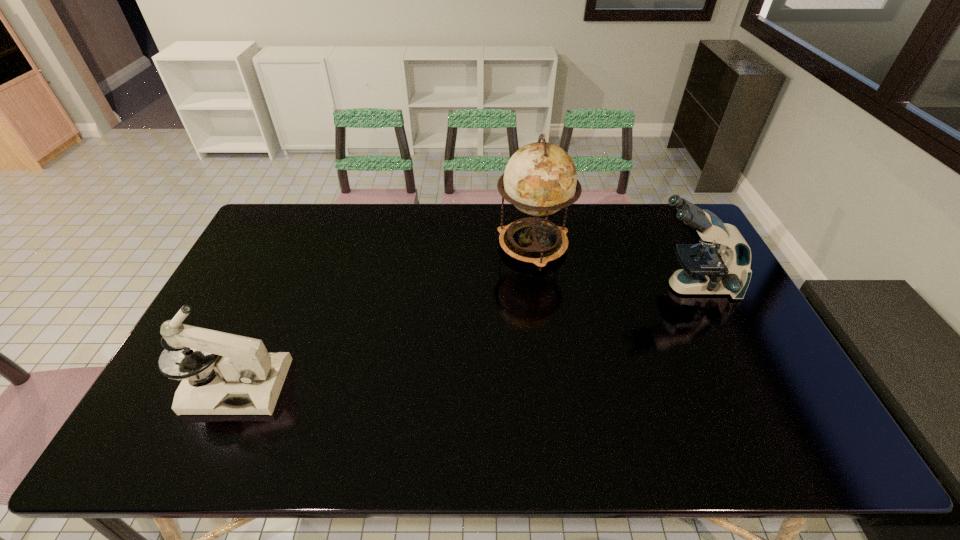
Where is `globe`? The height and width of the screenshot is (540, 960). globe is located at coordinates (540, 178).

Locate an element on the screen. the tallest object is located at coordinates (x=540, y=178).

Where is `the rightmost object`? This screenshot has width=960, height=540. the rightmost object is located at coordinates (706, 269).

Where is `the right microscope`? the right microscope is located at coordinates (706, 269).

Locate an element on the screen. Image resolution: width=960 pixels, height=540 pixels. the nearer microscope is located at coordinates (248, 381).

The width and height of the screenshot is (960, 540). Find the location of `the leftmost object`. the leftmost object is located at coordinates (248, 381).

I want to click on vacant space located at the center of the second object from left to right, so click(540, 300).

Where is `vacant space located through the eyepieces of the farther microscope`? The width and height of the screenshot is (960, 540). vacant space located through the eyepieces of the farther microscope is located at coordinates (604, 287).

In order to click on blank space located through the eyepieces of the farther microscope in this screenshot , I will do `click(597, 287)`.

Locate an element on the screen. The image size is (960, 540). vacant space situated through the eyepieces of the farther microscope is located at coordinates (613, 287).